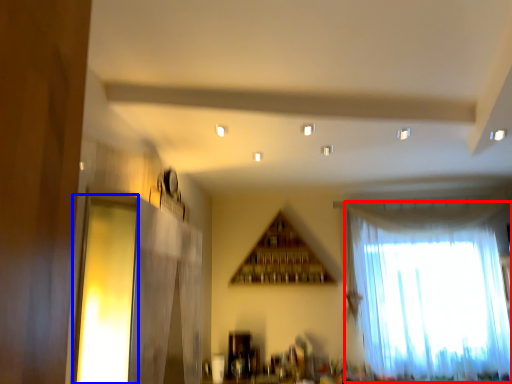
Question: Which of the following is the farthest to the observer, curtain (highlighted by a red box) or window (highlighted by a blue box)?

Choices:
 (A) curtain
 (B) window

Answer: (A)